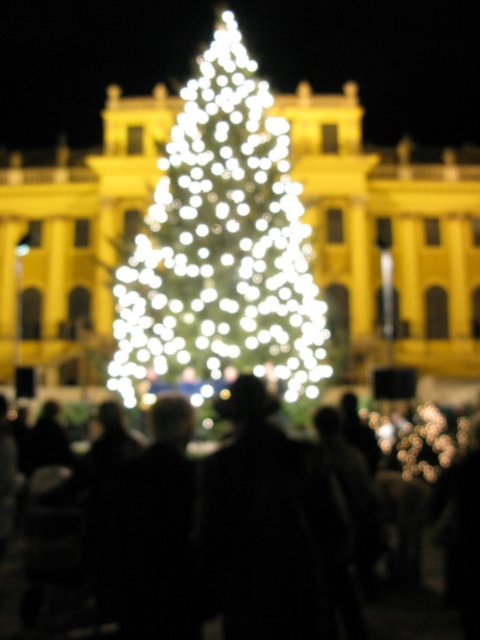
You are standing in the middle of the scene and want to take a photo of both the yellow matte building at center and the illuminated glass christmas tree at center. Which object should you point your camera upwards to capture?

You should point your camera upwards to capture the illuminated glass christmas tree at center because the yellow matte building at center is located below it.

You are standing in front of the festive scene and want to take a photo. You notice two points in the image, point (419, 259) and point (4, 577). Which point is closer to your camera?

Point (4, 577) is closer to the camera than point (419, 259) because the description states that point (419, 259) is further to the camera than point (4, 577).